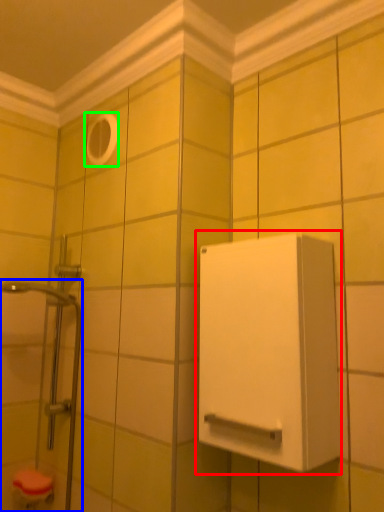
Question: Considering the real-world distances, which object is closest to medicine cabinet (highlighted by a red box)? shower door (highlighted by a blue box) or hole (highlighted by a green box).

Choices:
 (A) shower door
 (B) hole

Answer: (A)